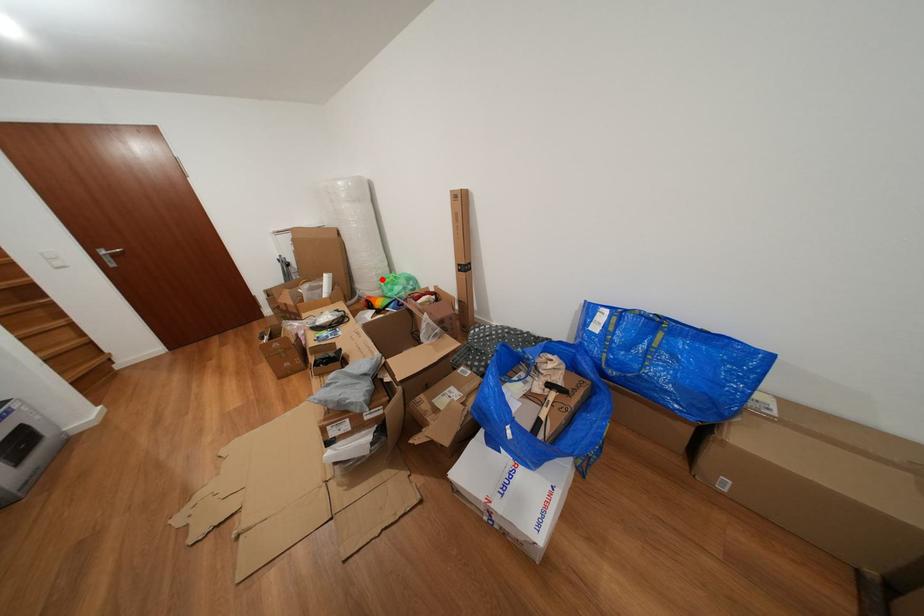
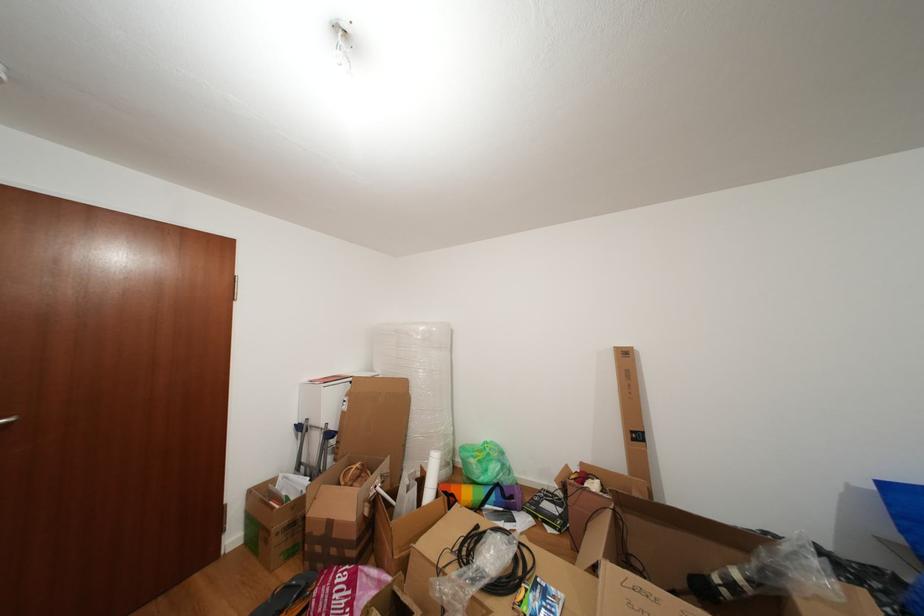
Question: I am providing you with two images of the same scene from different viewpoints. Given a red point in image1, look at the same physical point in image2. Is it:

Choices:
 (A) Closer to the viewpoint
 (B) Farther from the viewpoint

Answer: (B)